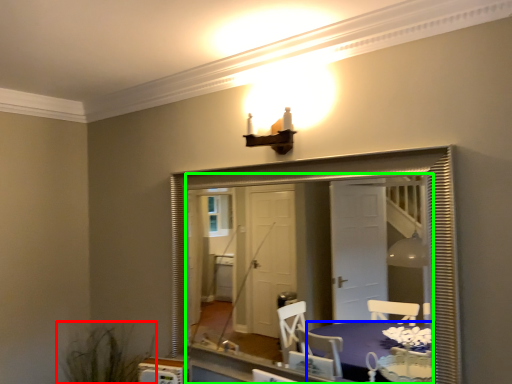
Question: Which object is positioned farthest from plant (highlighted by a red box)? Select from table (highlighted by a blue box) and mirror (highlighted by a green box).

Choices:
 (A) table
 (B) mirror

Answer: (B)